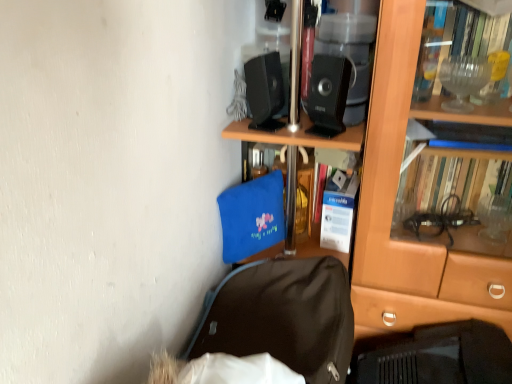
Question: Should I look upward or downward to see black fabric backpack at lower center?

Choices:
 (A) down
 (B) up

Answer: (A)

Question: Considering the relative sizes of black fabric backpack at lower center and black plastic speaker at upper center, marked as the 2th loudspeaker in a left-to-right arrangement, in the image provided, is black fabric backpack at lower center smaller than black plastic speaker at upper center, marked as the 2th loudspeaker in a left-to-right arrangement,?

Choices:
 (A) yes
 (B) no

Answer: (B)

Question: Can you confirm if black fabric backpack at lower center is thinner than black plastic speaker at upper center, marked as the 2th loudspeaker in a left-to-right arrangement?

Choices:
 (A) no
 (B) yes

Answer: (A)

Question: From a real-world perspective, is black fabric backpack at lower center below black plastic speaker at upper center, marked as the 2th loudspeaker in a left-to-right arrangement?

Choices:
 (A) yes
 (B) no

Answer: (A)

Question: Is black fabric backpack at lower center taller than black plastic speaker at upper center, marked as the 2th loudspeaker in a left-to-right arrangement?

Choices:
 (A) yes
 (B) no

Answer: (B)

Question: Is black fabric backpack at lower center placed right next to black plastic speaker at upper center, marked as the 2th loudspeaker in a left-to-right arrangement?

Choices:
 (A) no
 (B) yes

Answer: (A)

Question: From the image's perspective, is black fabric backpack at lower center on top of black plastic speaker at upper center, marked as the 2th loudspeaker in a left-to-right arrangement?

Choices:
 (A) no
 (B) yes

Answer: (A)

Question: Is black matte laptop at lower right at the left side of blue fabric bag at center?

Choices:
 (A) no
 (B) yes

Answer: (A)

Question: Is black matte laptop at lower right not close to blue fabric bag at center?

Choices:
 (A) no
 (B) yes

Answer: (A)

Question: Does black matte laptop at lower right have a smaller size compared to blue fabric bag at center?

Choices:
 (A) no
 (B) yes

Answer: (A)

Question: From a real-world perspective, is black matte laptop at lower right positioned under blue fabric bag at center based on gravity?

Choices:
 (A) yes
 (B) no

Answer: (A)

Question: From a real-world perspective, does black matte laptop at lower right stand above blue fabric bag at center?

Choices:
 (A) no
 (B) yes

Answer: (A)

Question: Is black matte laptop at lower right shorter than blue fabric bag at center?

Choices:
 (A) no
 (B) yes

Answer: (A)

Question: Is black matte laptop at lower right at the right side of brown wooden bookcase at center?

Choices:
 (A) yes
 (B) no

Answer: (A)